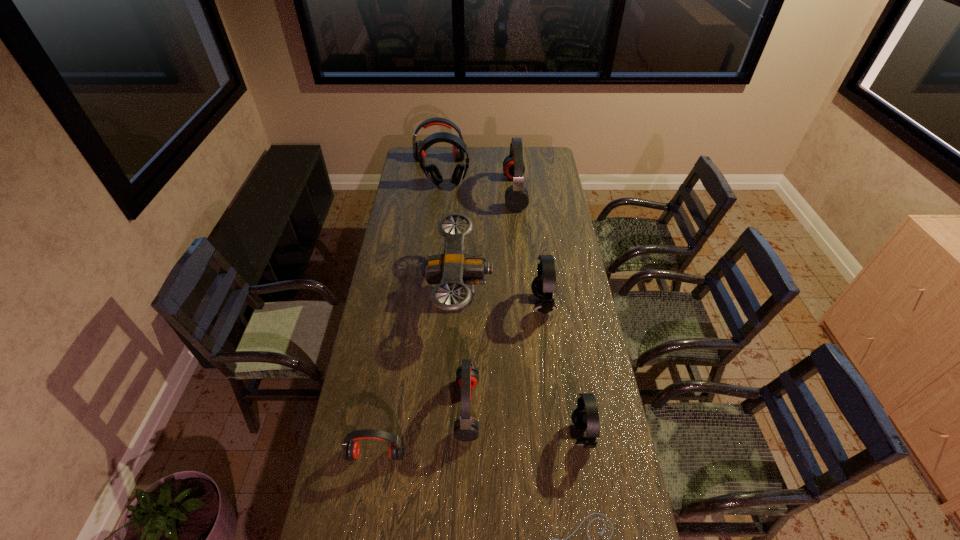
Image resolution: width=960 pixels, height=540 pixels. I want to click on the fourth closest earphone to the farthest black earphone, so click(466, 428).

Image resolution: width=960 pixels, height=540 pixels. I want to click on earphone that is the fifth closest to the third red earphone from left to right, so click(431, 171).

Identify which red earphone is located as the third nearest to the farthest earphone. Please provide its 2D coordinates. Your answer should be formatted as a tuple, i.e. [(x, y)], where the tuple contains the x and y coordinates of a point satisfying the conditions above.

[(351, 448)]

Locate which red earphone is the closest to the biggest red earphone. Please provide its 2D coordinates. Your answer should be formatted as a tuple, i.e. [(x, y)], where the tuple contains the x and y coordinates of a point satisfying the conditions above.

[(457, 154)]

Choose which black earphone is the second nearest neighbor to the smallest black earphone. Please provide its 2D coordinates. Your answer should be formatted as a tuple, i.e. [(x, y)], where the tuple contains the x and y coordinates of a point satisfying the conditions above.

[(431, 171)]

Point out which black earphone is positioned as the nearest to the nearest black earphone. Please provide its 2D coordinates. Your answer should be formatted as a tuple, i.e. [(x, y)], where the tuple contains the x and y coordinates of a point satisfying the conditions above.

[(543, 285)]